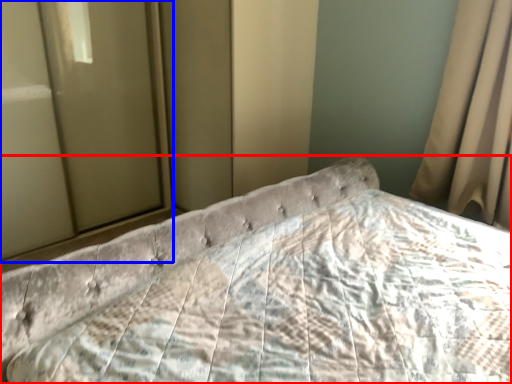
Question: Which object appears closest to the camera in this image, bed (highlighted by a red box) or glass door (highlighted by a blue box)?

Choices:
 (A) bed
 (B) glass door

Answer: (A)